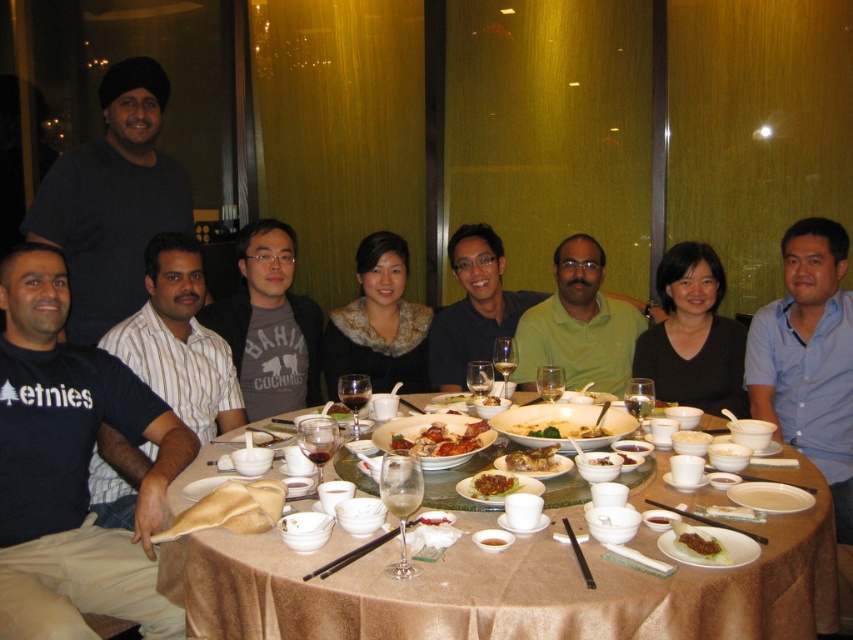
Looking at this image, measure the distance between green matte shirt at center and golden brown fried chicken at center.

The distance of green matte shirt at center from golden brown fried chicken at center is 3.41 feet.

Which is more to the left, green matte shirt at center or golden brown fried chicken at center?

From the viewer's perspective, golden brown fried chicken at center appears more on the left side.

Which is behind, point (570, 275) or point (592, 433)?

Point (570, 275)

At what (x,y) coordinates should I click in order to perform the action: click on green matte shirt at center. Please return your answer as a coordinate pair (x, y). Looking at the image, I should click on (579, 324).

Is golden brown fried chicken at center closer to camera compared to brown crispy chicken at center?

No, it is not.

Is point (602, 435) less distant than point (543, 448)?

No.

Who is more distant from viewer, (531, 435) or (508, 468)?

Point (531, 435)

At what (x,y) coordinates should I click in order to perform the action: click on golden brown fried chicken at center. Please return your answer as a coordinate pair (x, y). Looking at the image, I should click on (558, 429).

Does brown matte meat at lower right appear on the left side of brown glossy bowl at center?

No, brown matte meat at lower right is not to the left of brown glossy bowl at center.

Does brown matte meat at lower right have a greater height compared to brown glossy bowl at center?

Yes.

Is point (701, 531) farther from viewer compared to point (488, 400)?

No, (701, 531) is in front of (488, 400).

Find the location of `brown matte meat at lower right`. brown matte meat at lower right is located at coordinates (698, 541).